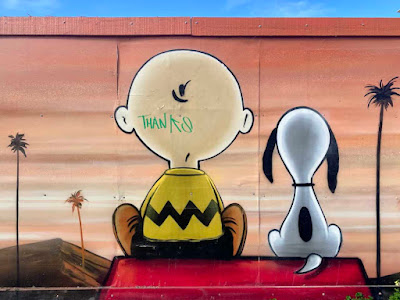
Find the location of a particular element. mural is located at coordinates (287, 66).